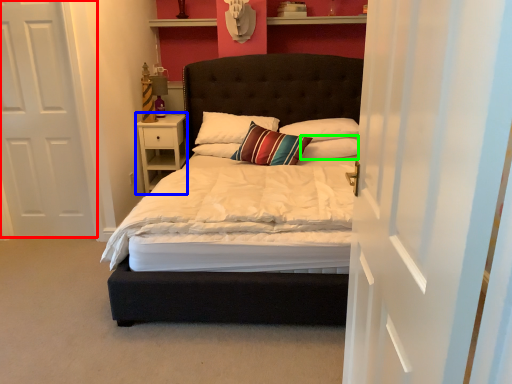
Question: Which is nearer to the door (highlighted by a red box)? nightstand (highlighted by a blue box) or pillow (highlighted by a green box).

Choices:
 (A) nightstand
 (B) pillow

Answer: (A)